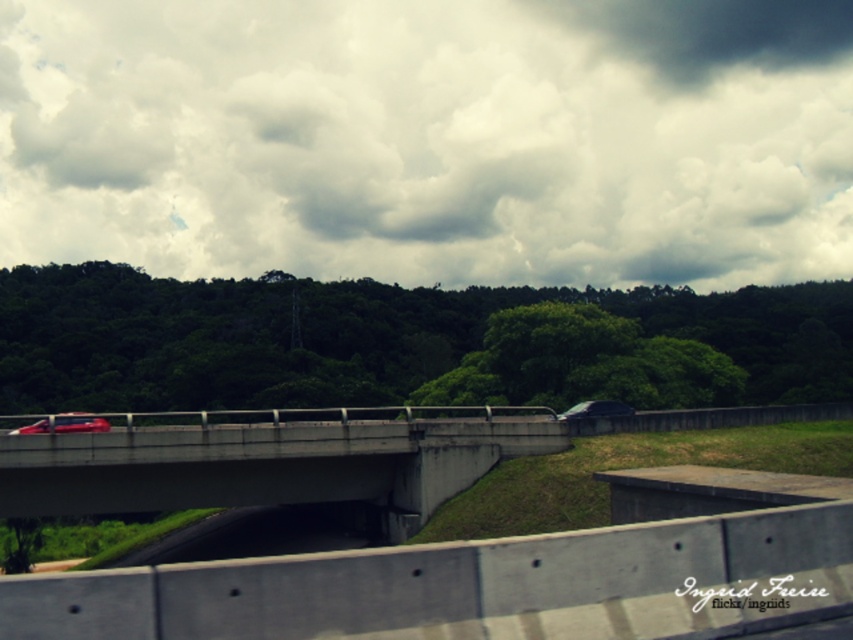
How far apart are shiny red car at center and smokey gray car at center?

shiny red car at center and smokey gray car at center are 18.72 meters apart from each other.

Which is more to the right, shiny red car at center or smokey gray car at center?

smokey gray car at center is more to the right.

Is point (54, 420) in front of point (601, 401)?

Yes, point (54, 420) is closer to viewer.

Find the location of a particular element. Image resolution: width=853 pixels, height=640 pixels. shiny red car at center is located at coordinates (65, 424).

Can you confirm if concrete bridge at center is taller than shiny red car at center?

Yes, concrete bridge at center is taller than shiny red car at center.

The height and width of the screenshot is (640, 853). I want to click on concrete bridge at center, so (x=265, y=465).

Where is `concrete bridge at center`? The width and height of the screenshot is (853, 640). concrete bridge at center is located at coordinates (265, 465).

You are a GUI agent. You are given a task and a screenshot of the screen. Output one action in this format:
    pyautogui.click(x=<x>, y=<y>)
    Task: Click on the concrete bridge at center
    
    Given the screenshot: What is the action you would take?
    pyautogui.click(x=265, y=465)

Who is lower down, cloudy sky at upper center or concrete bridge at center?

concrete bridge at center

Image resolution: width=853 pixels, height=640 pixels. I want to click on cloudy sky at upper center, so [431, 140].